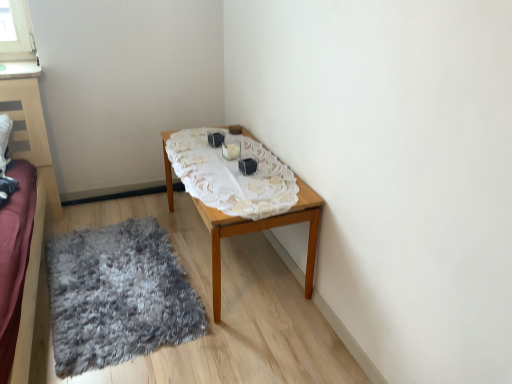
Question: Does wooden table at center touch white lace tablecloth at center?

Choices:
 (A) yes
 (B) no

Answer: (B)

Question: From the image's perspective, is wooden table at center above white lace tablecloth at center?

Choices:
 (A) no
 (B) yes

Answer: (A)

Question: Does wooden table at center come in front of white lace tablecloth at center?

Choices:
 (A) no
 (B) yes

Answer: (A)

Question: Does wooden table at center appear on the left side of white lace tablecloth at center?

Choices:
 (A) no
 (B) yes

Answer: (A)

Question: Can you confirm if wooden table at center is smaller than white lace tablecloth at center?

Choices:
 (A) yes
 (B) no

Answer: (B)

Question: Is wooden table at center taller than white lace tablecloth at center?

Choices:
 (A) no
 (B) yes

Answer: (B)

Question: Can you confirm if white lace tablecloth at center is shorter than gray shaggy rug at lower left?

Choices:
 (A) no
 (B) yes

Answer: (B)

Question: Is white lace tablecloth at center smaller than gray shaggy rug at lower left?

Choices:
 (A) no
 (B) yes

Answer: (B)

Question: From a real-world perspective, does white lace tablecloth at center stand above gray shaggy rug at lower left?

Choices:
 (A) no
 (B) yes

Answer: (B)

Question: Does white lace tablecloth at center contain gray shaggy rug at lower left?

Choices:
 (A) yes
 (B) no

Answer: (B)

Question: Is white lace tablecloth at center taller than gray shaggy rug at lower left?

Choices:
 (A) no
 (B) yes

Answer: (A)

Question: Are white lace tablecloth at center and gray shaggy rug at lower left beside each other?

Choices:
 (A) yes
 (B) no

Answer: (B)

Question: From a real-world perspective, is wooden table at center physically above gray shaggy rug at lower left?

Choices:
 (A) yes
 (B) no

Answer: (A)